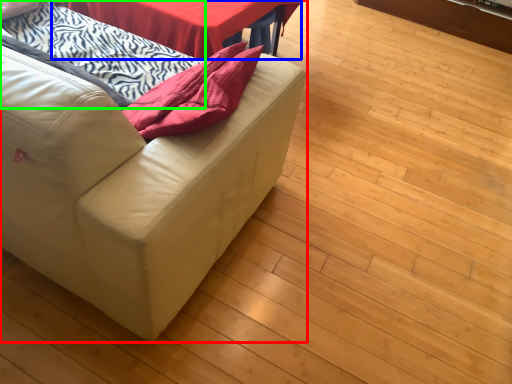
Question: Which object is positioned farthest from studio couch (highlighted by a red box)? Select from table (highlighted by a blue box) and blanket (highlighted by a green box).

Choices:
 (A) table
 (B) blanket

Answer: (A)